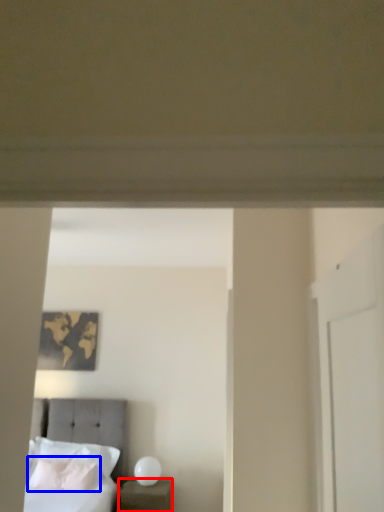
Question: Which object is closer to the camera taking this photo, nightstand (highlighted by a red box) or pillow (highlighted by a blue box)?

Choices:
 (A) nightstand
 (B) pillow

Answer: (A)